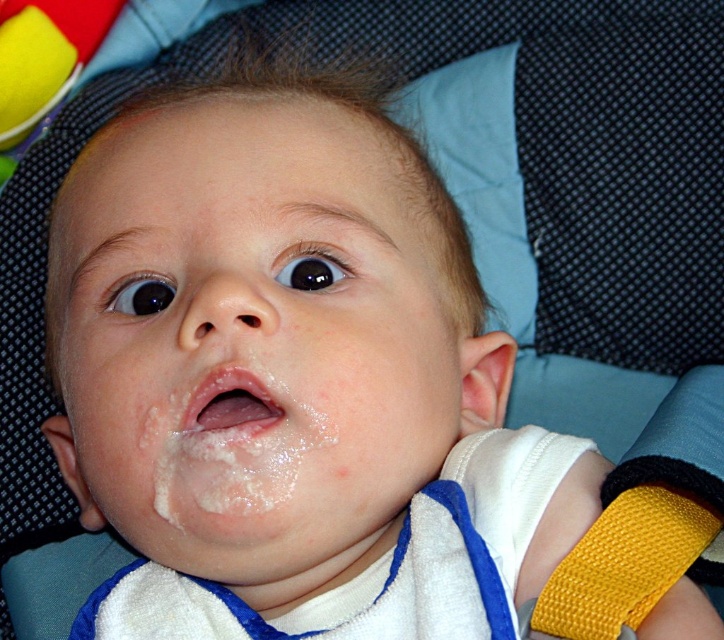
In the scene shown: Does smooth skin baby face at center appear over white glossy lips at center?

Yes, smooth skin baby face at center is above white glossy lips at center.

Describe the element at coordinates (252, 333) in the screenshot. I see `smooth skin baby face at center` at that location.

Between point (411, 292) and point (260, 413), which one is positioned behind?

Point (411, 292)

You are a GUI agent. You are given a task and a screenshot of the screen. Output one action in this format:
    pyautogui.click(x=<x>, y=<y>)
    Task: Click on the smooth skin baby face at center
    
    Given the screenshot: What is the action you would take?
    pyautogui.click(x=252, y=333)

Which is above, smooth skin baby face at center or yellow fabric strap at lower right?

smooth skin baby face at center

Is smooth skin baby face at center shorter than yellow fabric strap at lower right?

No, smooth skin baby face at center is not shorter than yellow fabric strap at lower right.

Which is in front, point (155, 406) or point (594, 522)?

Point (155, 406) is in front.

I want to click on smooth skin baby face at center, so click(x=252, y=333).

Is yellow fabric strap at lower right closer to camera compared to white glossy lips at center?

That is True.

This screenshot has height=640, width=724. I want to click on yellow fabric strap at lower right, so pos(623,563).

You are a GUI agent. You are given a task and a screenshot of the screen. Output one action in this format:
    pyautogui.click(x=<x>, y=<y>)
    Task: Click on the yellow fabric strap at lower right
    Image resolution: width=724 pixels, height=640 pixels.
    Given the screenshot: What is the action you would take?
    pyautogui.click(x=623, y=563)